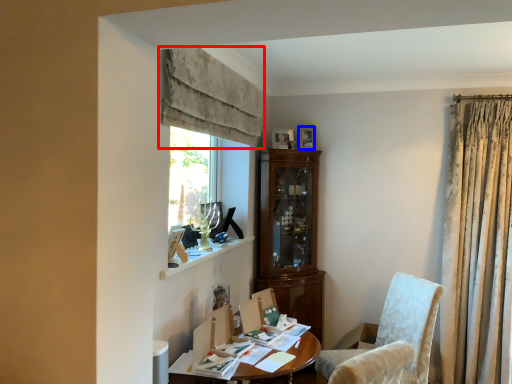
Question: Which object appears closest to the camera in this image, curtain (highlighted by a red box) or picture frame (highlighted by a blue box)?

Choices:
 (A) curtain
 (B) picture frame

Answer: (A)